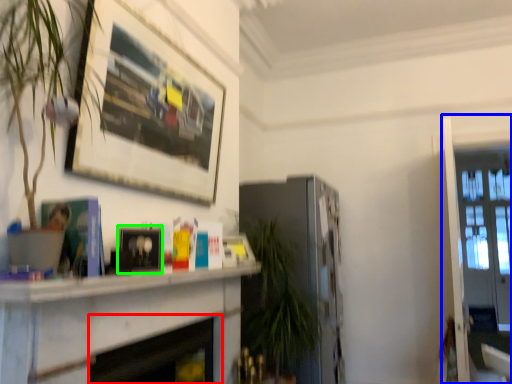
Question: Which is farther away from fireplace (highlighted by a red box)? glass door (highlighted by a blue box) or picture frame (highlighted by a green box)?

Choices:
 (A) glass door
 (B) picture frame

Answer: (A)